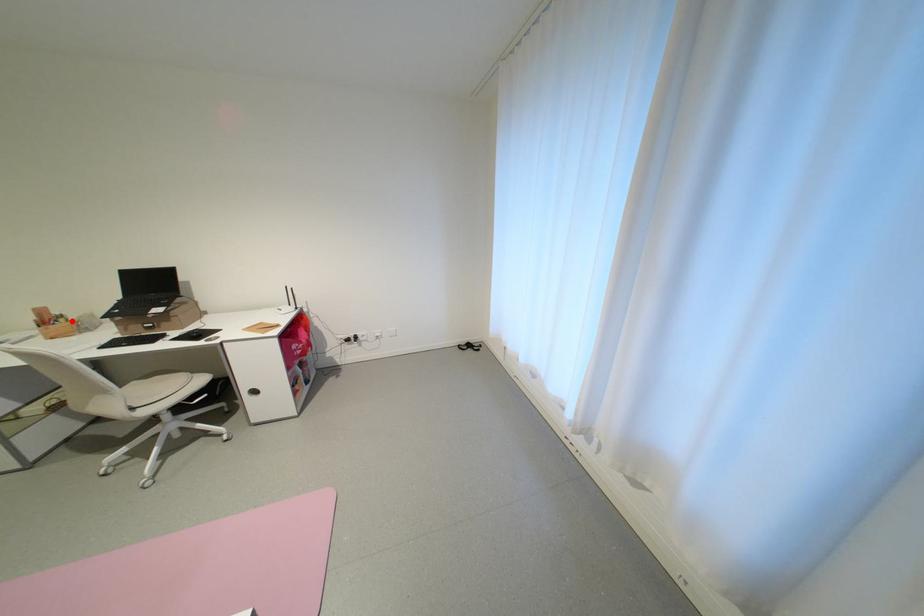
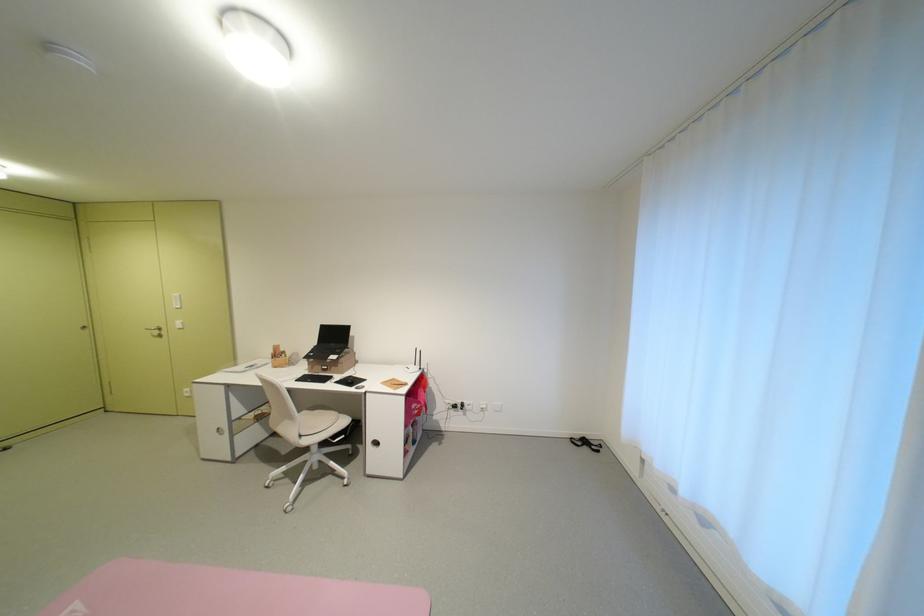
Question: I am providing you with two images of the same scene from different viewpoints. A red point is shown in image1. For the corresponding object point in image2, is it positioned nearer or farther from the camera?

Choices:
 (A) Nearer
 (B) Farther

Answer: (B)